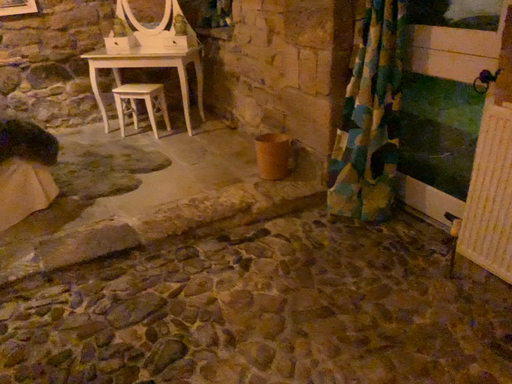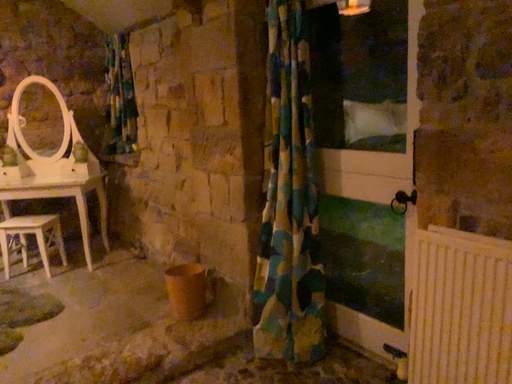
Question: How did the camera likely rotate when shooting the video?

Choices:
 (A) rotated left
 (B) rotated right

Answer: (B)